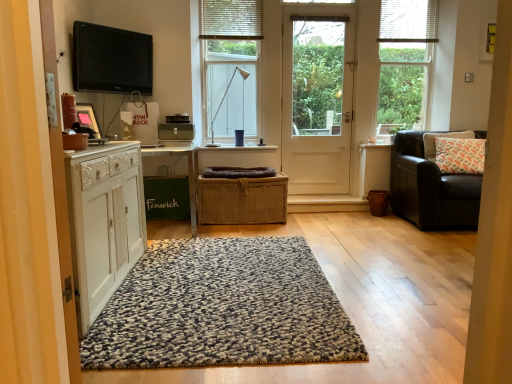
Question: Is textured wool rug at center to the left or to the right of braided brown basket at center in the image?

Choices:
 (A) right
 (B) left

Answer: (B)

Question: From their relative heights in the image, would you say textured wool rug at center is taller or shorter than braided brown basket at center?

Choices:
 (A) tall
 (B) short

Answer: (B)

Question: Which object is the farthest from the leather couch at right?

Choices:
 (A) white textured blind at upper center, which is counted as the 2th blind, starting from the right
 (B) green fabric bag at left
 (C) white textured window at center, which is the 2th window from right to left
 (D) white fabric pillow at right
 (E) white fabric blinds at upper right, the 2th blind when ordered from left to right

Answer: (B)

Question: Which object is the closest to the white wooden door at center?

Choices:
 (A) white textured blind at upper center, which is counted as the 2th blind, starting from the right
 (B) transparent glass window at upper right, positioned as the 1th window in right-to-left order
 (C) leather couch at right
 (D) black glossy tv at upper left
 (E) textured wool rug at center

Answer: (B)